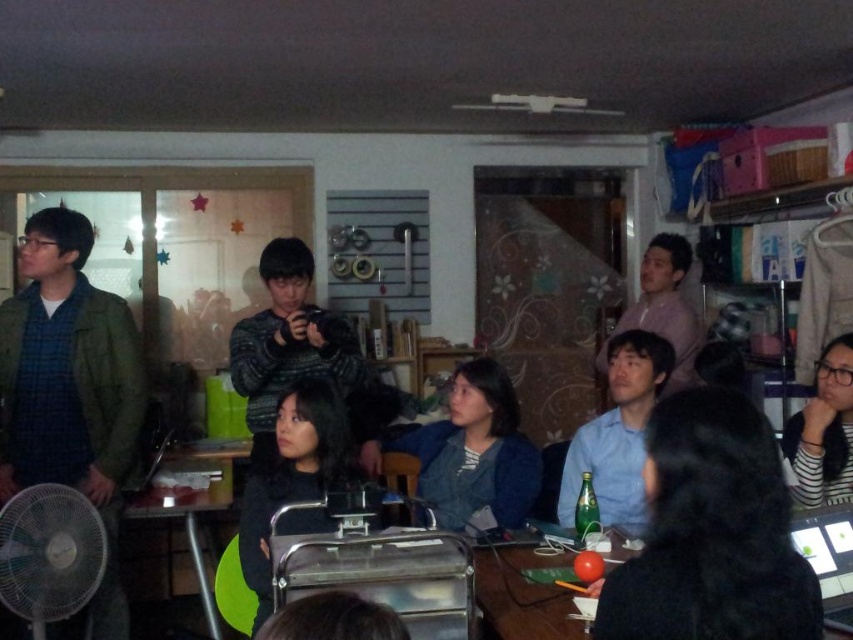
Who is lower down, black matte shirt at center or matte black table at center?

matte black table at center is below.

Does black matte shirt at center have a greater height compared to matte black table at center?

Correct, black matte shirt at center is much taller as matte black table at center.

Where is `black matte shirt at center`? black matte shirt at center is located at coordinates (711, 532).

Which is below, black plastic fan at lower left or matte black table at center?

Positioned lower is black plastic fan at lower left.

Is point (12, 506) behind point (479, 548)?

No, it is in front of (479, 548).

The height and width of the screenshot is (640, 853). I want to click on black plastic fan at lower left, so click(49, 554).

Find the location of `black plastic fan at lower left`. black plastic fan at lower left is located at coordinates (x=49, y=554).

Describe the element at coordinates (49, 554) in the screenshot. This screenshot has width=853, height=640. I see `black plastic fan at lower left` at that location.

Is point (24, 579) in front of point (828, 436)?

Yes, it is in front of point (828, 436).

What are the coordinates of `black plastic fan at lower left` in the screenshot? It's located at (49, 554).